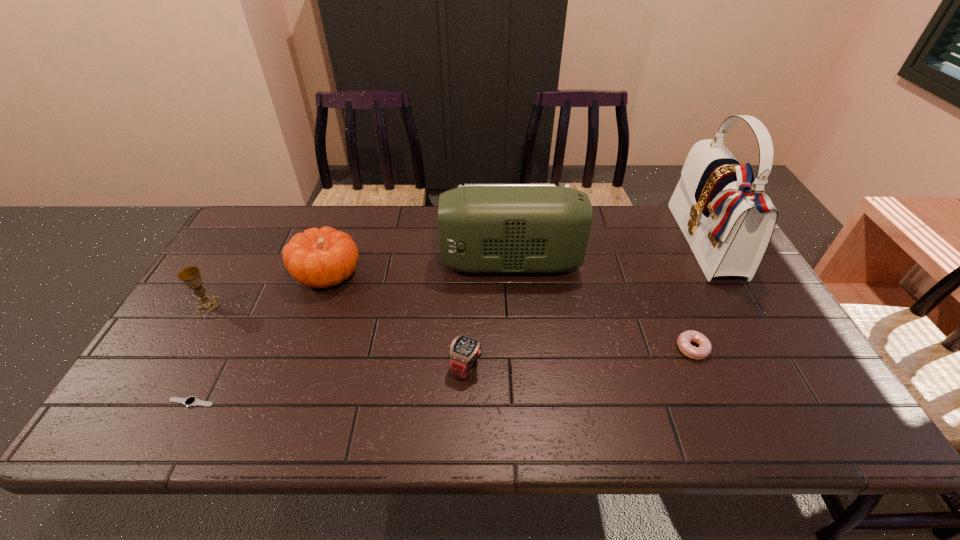
This screenshot has height=540, width=960. I want to click on vacant space at the far edge of the desktop, so click(400, 212).

Identify the location of vacant space at the near edge of the desktop. This screenshot has width=960, height=540. (705, 422).

I want to click on free point at the left edge, so click(x=217, y=323).

Image resolution: width=960 pixels, height=540 pixels. Find the location of `free space at the far right corner of the desktop`. free space at the far right corner of the desktop is located at coordinates (670, 217).

I want to click on vacant region between the leftmost object and the radio_receiver, so click(x=359, y=284).

I want to click on empty location between the pumpkin and the sixth tallest object, so click(510, 312).

I want to click on empty space between the sixth tallest object and the third shortest object, so click(x=580, y=357).

You are a GUI agent. You are given a task and a screenshot of the screen. Output one action in this format:
    pyautogui.click(x=<x>, y=<y>)
    Task: Click on the free spot between the nearest object and the radio_receiver
    The image size is (960, 540).
    Given the screenshot: What is the action you would take?
    pyautogui.click(x=351, y=333)

This screenshot has height=540, width=960. Identify the location of unoccupied position between the shortest object and the sixth shortest object. (351, 333).

Find the location of a particular element. This screenshot has width=960, height=540. vacant area between the leftmost object and the right watch is located at coordinates (337, 335).